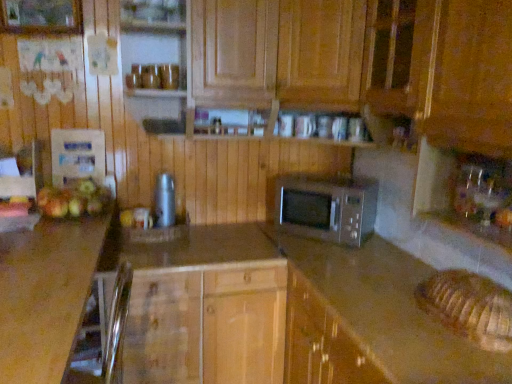
Question: Can you confirm if wooden cabinet at center is shorter than green matte apple at left, the 1th apple positioned from the back?

Choices:
 (A) yes
 (B) no

Answer: (B)

Question: Is wooden cabinet at center not close to green matte apple at left, the 1th apple positioned from the back?

Choices:
 (A) yes
 (B) no

Answer: (B)

Question: Is wooden cabinet at center oriented towards green matte apple at left, placed as the second apple when sorted from top to bottom?

Choices:
 (A) yes
 (B) no

Answer: (B)

Question: Considering the relative sizes of wooden cabinet at center and green matte apple at left, the 1th apple ordered from the bottom, in the image provided, is wooden cabinet at center bigger than green matte apple at left, the 1th apple ordered from the bottom,?

Choices:
 (A) yes
 (B) no

Answer: (A)

Question: Is wooden cabinet at center completely or partially outside of green matte apple at left, the 1th apple ordered from the bottom?

Choices:
 (A) yes
 (B) no

Answer: (A)

Question: Is green matte apple at left, the 1th apple positioned from the back, wider or thinner than transparent glass sink at right?

Choices:
 (A) thin
 (B) wide

Answer: (A)

Question: Considering the positions of green matte apple at left, the 1th apple ordered from the bottom, and transparent glass sink at right in the image, is green matte apple at left, the 1th apple ordered from the bottom, bigger or smaller than transparent glass sink at right?

Choices:
 (A) small
 (B) big

Answer: (A)

Question: From the image's perspective, is green matte apple at left, the second apple in the front-to-back sequence, located above or below transparent glass sink at right?

Choices:
 (A) below
 (B) above

Answer: (A)

Question: Relative to transparent glass sink at right, is green matte apple at left, the second apple in the front-to-back sequence, in front or behind?

Choices:
 (A) front
 (B) behind

Answer: (B)

Question: Considering the positions of point click(402, 266) and point click(478, 180), is point click(402, 266) closer or farther from the camera than point click(478, 180)?

Choices:
 (A) closer
 (B) farther

Answer: (B)

Question: Considering the positions of brown laminate counter at center and transparent glass sink at right in the image, is brown laminate counter at center taller or shorter than transparent glass sink at right?

Choices:
 (A) tall
 (B) short

Answer: (A)

Question: Based on their sizes in the image, would you say brown laminate counter at center is bigger or smaller than transparent glass sink at right?

Choices:
 (A) big
 (B) small

Answer: (A)

Question: Would you say brown laminate counter at center is inside or outside transparent glass sink at right?

Choices:
 (A) inside
 (B) outside

Answer: (B)

Question: Based on their sizes in the image, would you say brown laminate counter at center is bigger or smaller than silver metallic microwave at center?

Choices:
 (A) small
 (B) big

Answer: (B)

Question: From the image's perspective, relative to silver metallic microwave at center, is brown laminate counter at center above or below?

Choices:
 (A) above
 (B) below

Answer: (B)